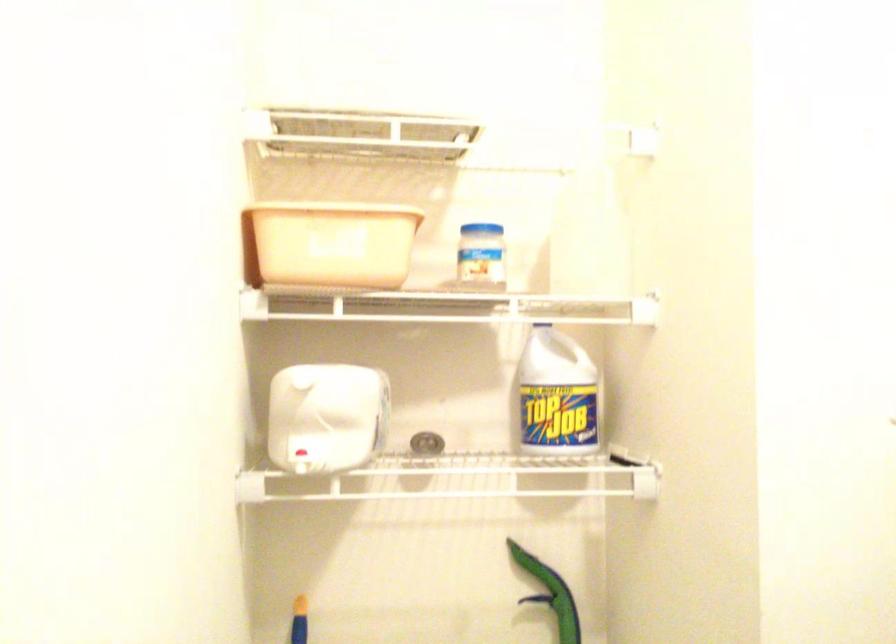
Where would you lift the white jug handle? Please return your answer as a coordinate pair (x, y).

(556, 395)